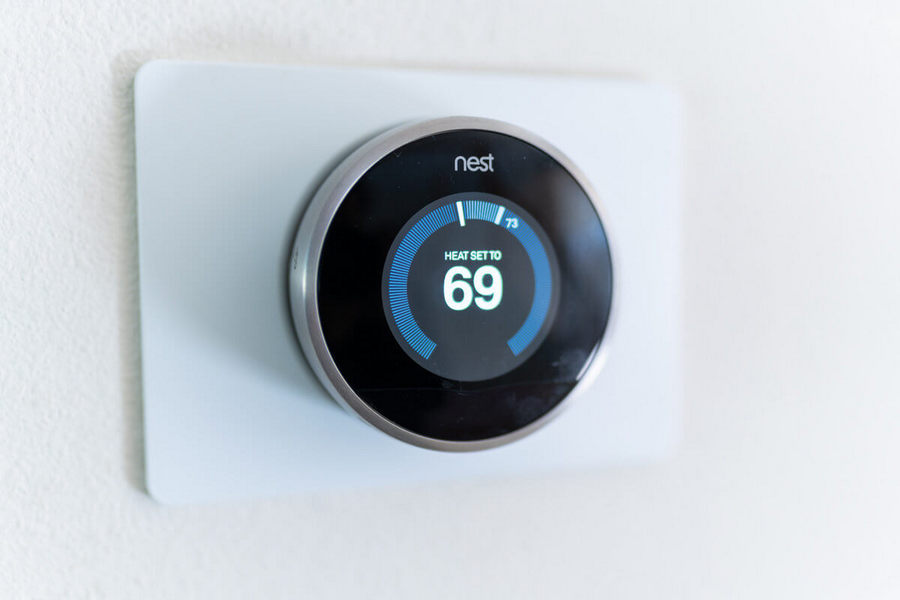
Identify the location of white mount for thermostat. (220, 139).